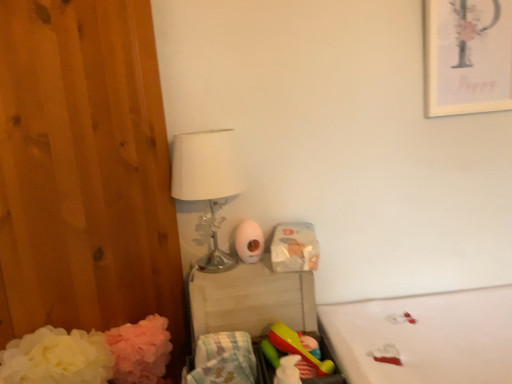
Question: Does matte white picture frame at upper right have a larger size compared to white fabric mattress at lower right?

Choices:
 (A) yes
 (B) no

Answer: (B)

Question: Is matte white picture frame at upper right not within white fabric mattress at lower right?

Choices:
 (A) yes
 (B) no

Answer: (A)

Question: From a real-world perspective, does matte white picture frame at upper right sit lower than white fabric mattress at lower right?

Choices:
 (A) yes
 (B) no

Answer: (B)

Question: From the image's perspective, is matte white picture frame at upper right over white fabric mattress at lower right?

Choices:
 (A) no
 (B) yes

Answer: (B)

Question: Would you say white fabric mattress at lower right is part of matte white picture frame at upper right's contents?

Choices:
 (A) yes
 (B) no

Answer: (B)

Question: From the image's perspective, is plastic changing table at center above or below white fabric mattress at lower right?

Choices:
 (A) below
 (B) above

Answer: (B)

Question: Considering the positions of plastic changing table at center and white fabric mattress at lower right in the image, is plastic changing table at center taller or shorter than white fabric mattress at lower right?

Choices:
 (A) tall
 (B) short

Answer: (A)

Question: Choose the correct answer: Is plastic changing table at center inside white fabric mattress at lower right or outside it?

Choices:
 (A) outside
 (B) inside

Answer: (A)

Question: In terms of size, does plastic changing table at center appear bigger or smaller than white fabric mattress at lower right?

Choices:
 (A) small
 (B) big

Answer: (A)

Question: Considering the positions of point (211, 359) and point (481, 379), is point (211, 359) closer or farther from the camera than point (481, 379)?

Choices:
 (A) farther
 (B) closer

Answer: (B)

Question: From the image's perspective, is pastel cotton blanket at lower center positioned above or below white fabric mattress at lower right?

Choices:
 (A) above
 (B) below

Answer: (B)

Question: Looking at their shapes, would you say pastel cotton blanket at lower center is wider or thinner than white fabric mattress at lower right?

Choices:
 (A) thin
 (B) wide

Answer: (A)

Question: Is pastel cotton blanket at lower center in front of or behind white fabric mattress at lower right in the image?

Choices:
 (A) behind
 (B) front

Answer: (B)

Question: From a real-world perspective, is white glossy table lamp at upper left physically located above or below white fabric mattress at lower right?

Choices:
 (A) below
 (B) above

Answer: (B)

Question: From the image's perspective, is white glossy table lamp at upper left above or below white fabric mattress at lower right?

Choices:
 (A) below
 (B) above

Answer: (B)